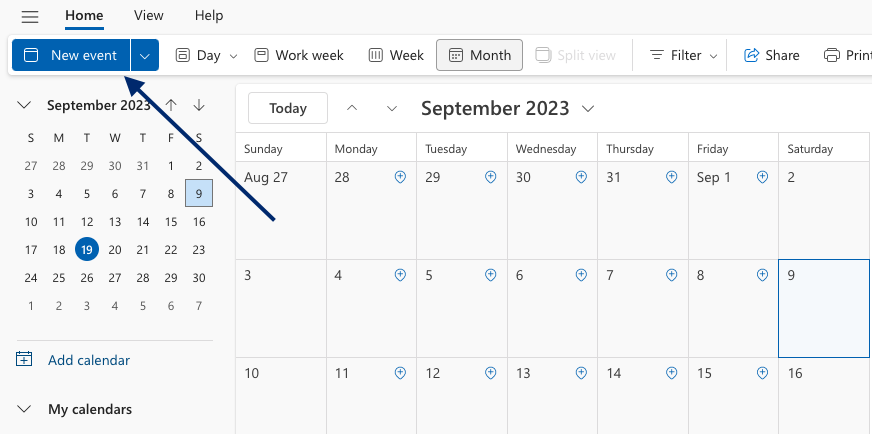
Where is `small calendar on left side`? The width and height of the screenshot is (872, 434). small calendar on left side is located at coordinates [89, 107], [51, 187], [162, 174], [159, 274], [44, 273].